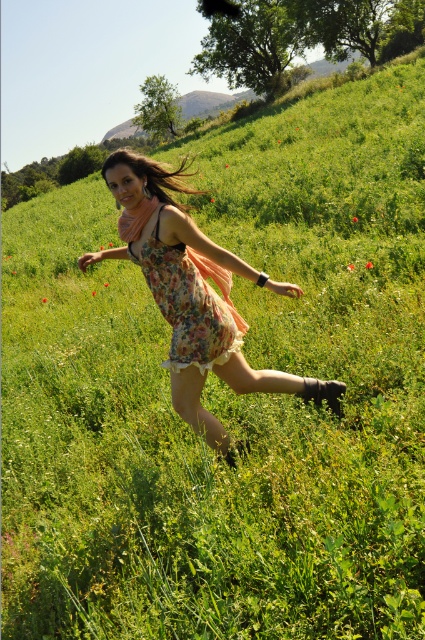
Can you confirm if floral dress at center is shorter than floral fabric dress at center?

Incorrect, floral dress at center's height does not fall short of floral fabric dress at center's.

In the scene shown: Is floral dress at center bigger than floral fabric dress at center?

Yes.

Between point (325, 396) and point (244, 330), which one is positioned in front?

Point (244, 330)

You are a GUI agent. You are given a task and a screenshot of the screen. Output one action in this format:
    pyautogui.click(x=<x>, y=<y>)
    Task: Click on the floral dress at center
    
    Given the screenshot: What is the action you would take?
    pyautogui.click(x=193, y=292)